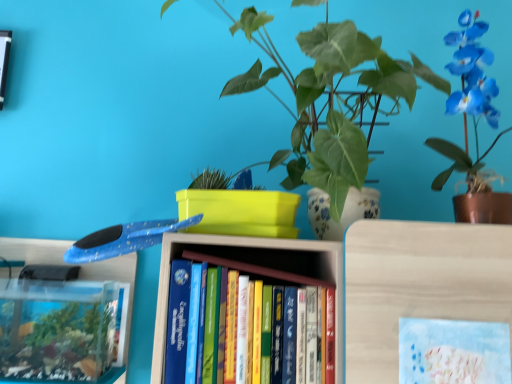
Question: In the image, is green glossy leafy plant at center, marked as the 1th houseplant in a left-to-right arrangement, positioned in front of or behind blue glossy orchid at upper right, which is the first houseplant from right to left?

Choices:
 (A) front
 (B) behind

Answer: (A)

Question: From a real-world perspective, relative to blue glossy orchid at upper right, arranged as the second houseplant when viewed from the left, is green glossy leafy plant at center, marked as the 1th houseplant in a left-to-right arrangement, vertically above or below?

Choices:
 (A) above
 (B) below

Answer: (B)

Question: Which of these objects is positioned farthest from the pastel blue paper at center?

Choices:
 (A) hardcover books at center
 (B) green glossy leafy plant at center, which is counted as the 2th houseplant, starting from the right
 (C) blue glossy orchid at upper right, arranged as the second houseplant when viewed from the left

Answer: (B)

Question: Based on their relative distances, which object is farther from the hardcover books at center?

Choices:
 (A) blue glossy orchid at upper right, which is the first houseplant from right to left
 (B) green glossy leafy plant at center, which is counted as the 2th houseplant, starting from the right
 (C) pastel blue paper at center

Answer: (A)